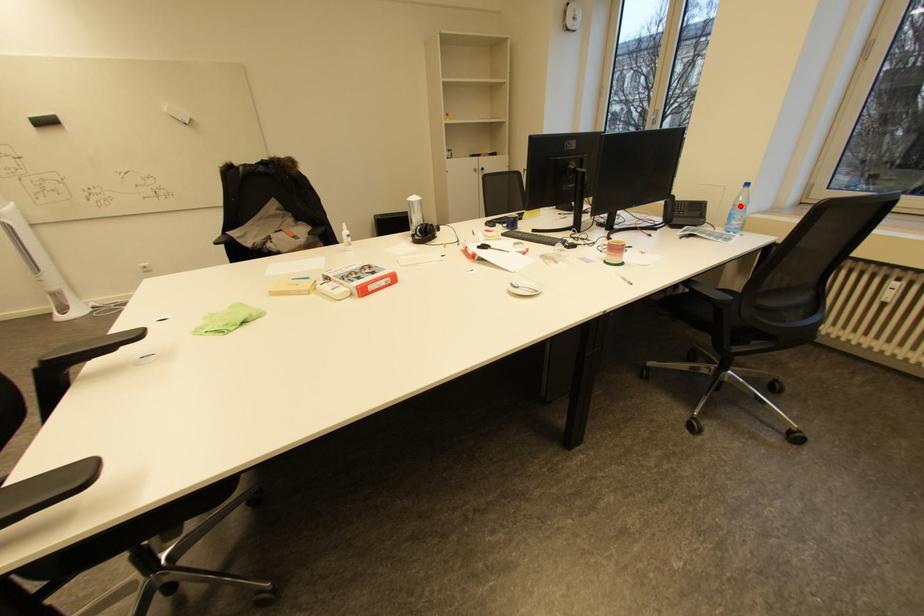
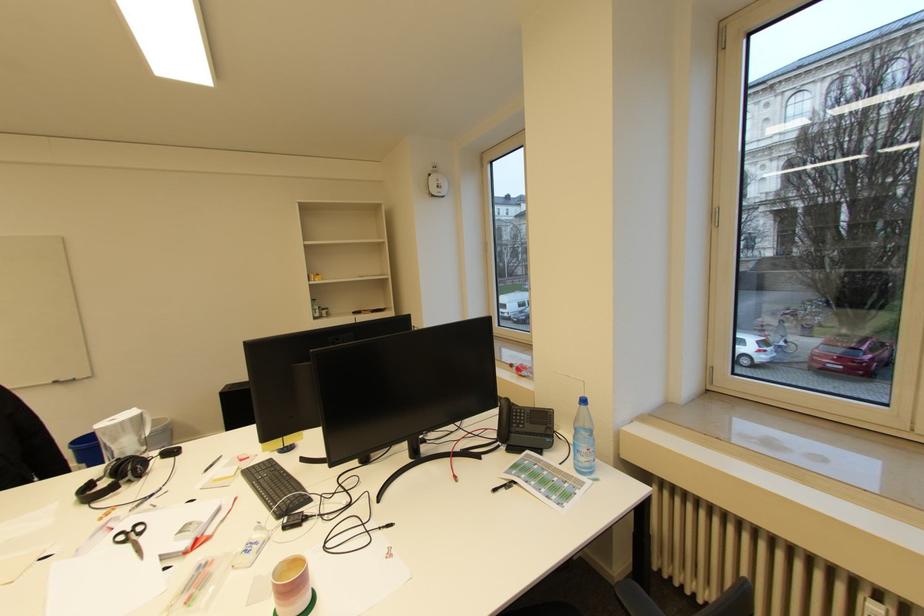
Locate, in the second image, the point that corresponds to the highlighted location in the first image.

(581, 429)